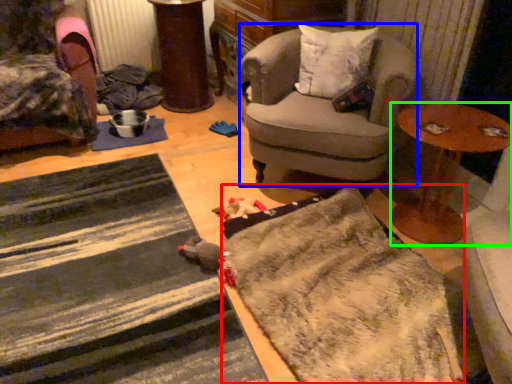
Question: Which object is positioned closest to doormat (highlighted by a red box)? Select from chair (highlighted by a blue box) and table (highlighted by a green box).

Choices:
 (A) chair
 (B) table

Answer: (B)